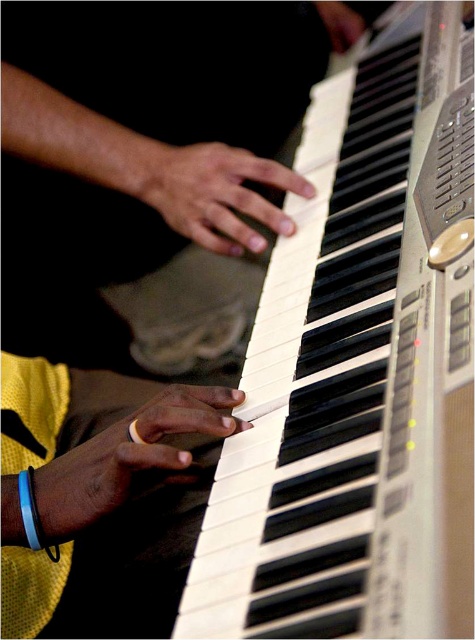
Who is taller, white plastic piano keys at center or yellow fabric wristband at upper left?

white plastic piano keys at center is taller.

Is point (307, 321) farther from viewer compared to point (95, 593)?

No.

Image resolution: width=475 pixels, height=640 pixels. What are the coordinates of `white plastic piano keys at center` in the screenshot? It's located at (360, 369).

Between point (323, 209) and point (349, 45), which one is positioned behind?

Point (349, 45)

Is white plastic piano keys at center below matte black hand at upper right?

Yes.

Is point (426, 49) in front of point (341, 40)?

Yes, point (426, 49) is in front of point (341, 40).

Identify the location of white plastic piano keys at center. This screenshot has width=475, height=640. (360, 369).

Who is shorter, yellow fabric wristband at upper left or smooth yellow ring at lower left?

Standing shorter between the two is smooth yellow ring at lower left.

Is yellow fabric wristband at upper left to the right of smooth yellow ring at lower left from the viewer's perspective?

In fact, yellow fabric wristband at upper left is to the left of smooth yellow ring at lower left.

Is point (55, 467) closer to viewer compared to point (173, 449)?

That is False.

In order to click on yellow fabric wristband at upper left in this screenshot , I will do `click(98, 497)`.